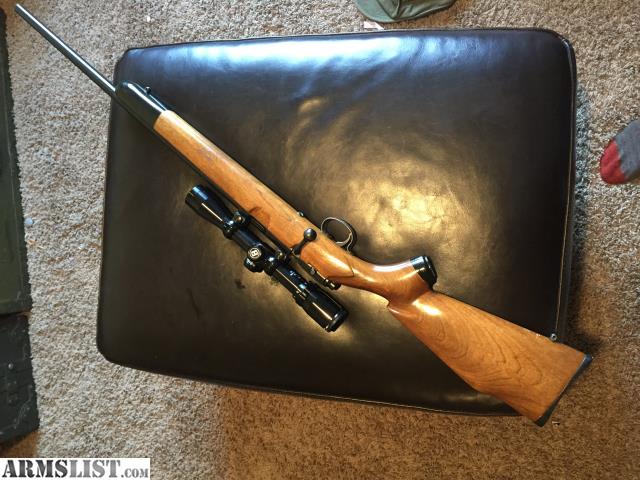
You are a GUI agent. You are given a task and a screenshot of the screen. Output one action in this format:
    pyautogui.click(x=<x>, y=<y>)
    Task: Click on the furniture cushion
    Image resolution: width=640 pixels, height=480 pixels.
    Given the screenshot: What is the action you would take?
    pyautogui.click(x=508, y=217), pyautogui.click(x=381, y=114), pyautogui.click(x=267, y=358), pyautogui.click(x=172, y=268)